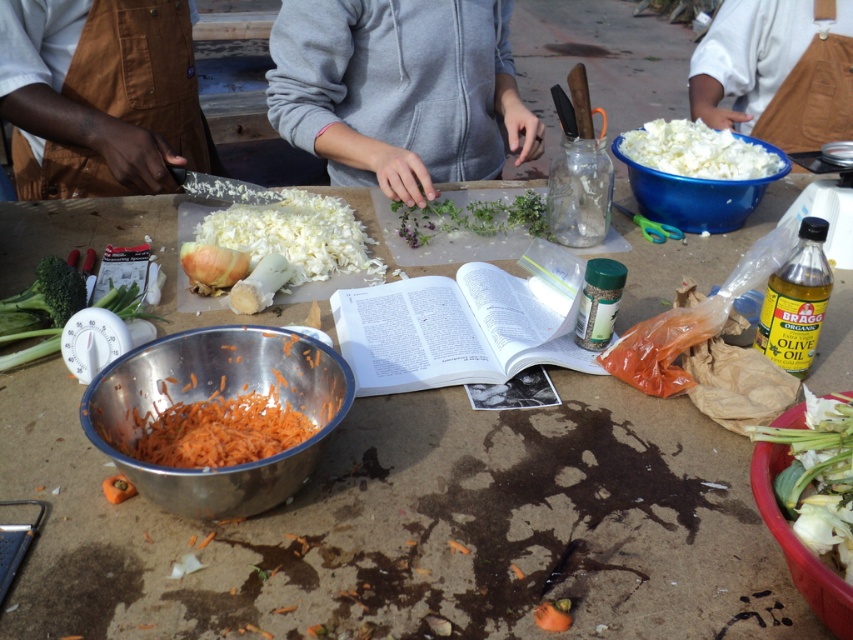
Question: Can you confirm if white papery flower at lower right is thinner than green leafy herb at center?

Choices:
 (A) yes
 (B) no

Answer: (A)

Question: Considering the real-world distances, which object is closest to the white papery flower at lower right?

Choices:
 (A) white fluffy cabbage at upper right
 (B) white fabric at upper right
 (C) brown canvas apron at left
 (D) white matte onion at center

Answer: (D)

Question: Which point appears closest to the camera in this image?

Choices:
 (A) (750, 170)
 (B) (276, 388)

Answer: (B)

Question: Which object is closer to the camera taking this photo?

Choices:
 (A) white papery flower at lower right
 (B) paperback book at center
 (C) gray zip-up hoodie at center
 (D) blue plastic bowl at upper right

Answer: (A)

Question: In this image, where is brown canvas apron at left located relative to green leafy herb at center?

Choices:
 (A) right
 (B) left

Answer: (B)

Question: Is shiny metallic bowl at lower left further to the viewer compared to white papery flower at lower right?

Choices:
 (A) no
 (B) yes

Answer: (B)